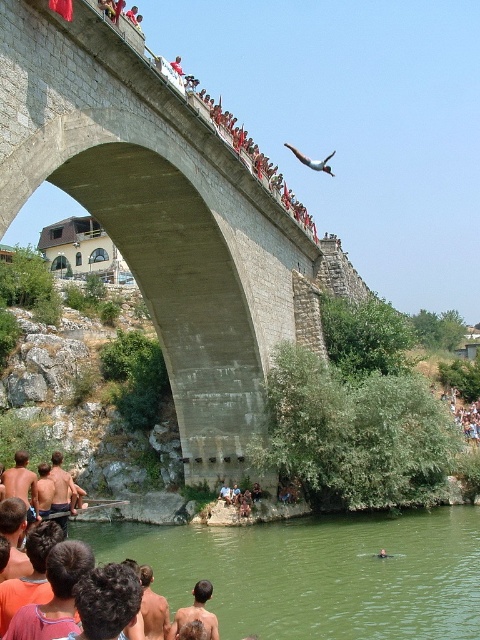
Looking at this image, you are standing on the bridge and see two points marked on the bridge surface. The first point is at coordinate point(153, 147) and the second is at point(330, 170). Which point is closer to you?

Point(153, 147) is closer to the viewer than point(330, 170).

You are a photographer trying to capture the brown hair at lower center and the concrete bridge at center in a single shot. Based on their positions, which object is closer to the camera?

The brown hair at lower center is closer to the camera because it is positioned lower in the frame compared to the concrete bridge at center, which is centrally located. In photography, lower positioned elements often appear closer to the viewer.